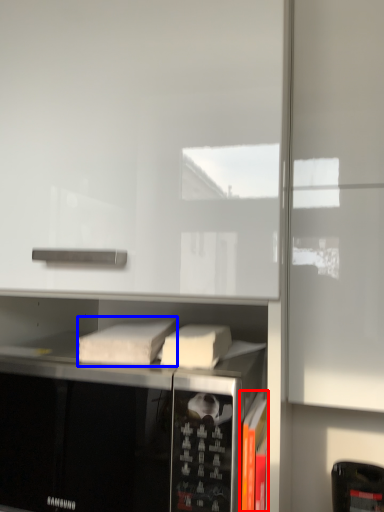
Question: Which point is closer to the camera, book (highlighted by a red box) or book (highlighted by a blue box)?

Choices:
 (A) book
 (B) book

Answer: (A)